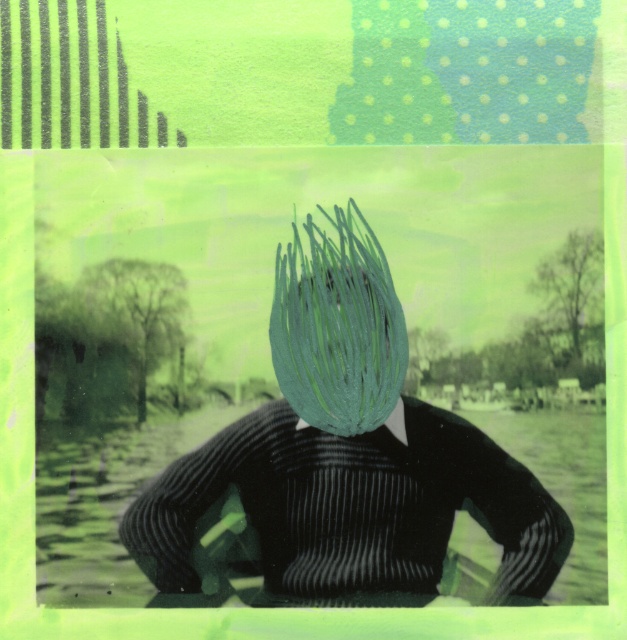
Question: Which of the following is the farthest from the observer?

Choices:
 (A) (404, 324)
 (B) (335, 294)

Answer: (B)

Question: Does matte green hairbrush at center come in front of green matte hair at center?

Choices:
 (A) no
 (B) yes

Answer: (B)

Question: Does matte green hairbrush at center lie in front of green matte hair at center?

Choices:
 (A) yes
 (B) no

Answer: (A)

Question: Which point is closer to the camera taking this photo?

Choices:
 (A) (456, 508)
 (B) (339, 403)

Answer: (A)

Question: Considering the relative positions of matte green hairbrush at center and green matte hair at center in the image provided, where is matte green hairbrush at center located with respect to green matte hair at center?

Choices:
 (A) below
 (B) above

Answer: (A)